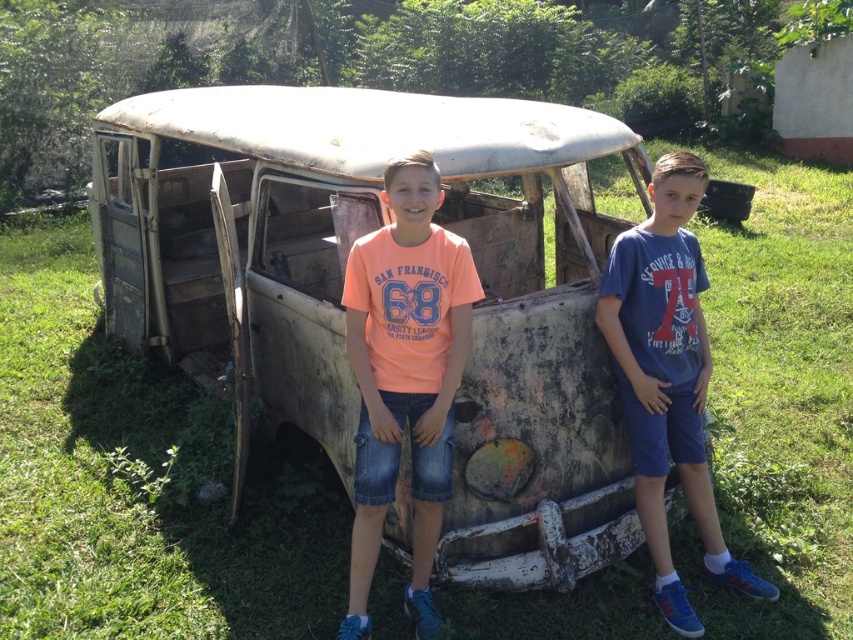
Question: Is rusty metal car at center wider than orange t-shirt at center?

Choices:
 (A) yes
 (B) no

Answer: (A)

Question: Which of these objects is positioned farthest from the rusty metal car at center?

Choices:
 (A) blue denim shorts at right
 (B) orange t-shirt at center

Answer: (A)

Question: Considering the real-world distances, which object is farthest from the orange t-shirt at center?

Choices:
 (A) blue denim shorts at right
 (B) rusty metal car at center

Answer: (A)

Question: Among these objects, which one is farthest from the camera?

Choices:
 (A) rusty metal car at center
 (B) orange t-shirt at center

Answer: (A)

Question: From the image, what is the correct spatial relationship of orange t-shirt at center in relation to blue denim shorts at right?

Choices:
 (A) left
 (B) right

Answer: (A)

Question: Is rusty metal car at center to the left of blue denim shorts at right from the viewer's perspective?

Choices:
 (A) yes
 (B) no

Answer: (A)